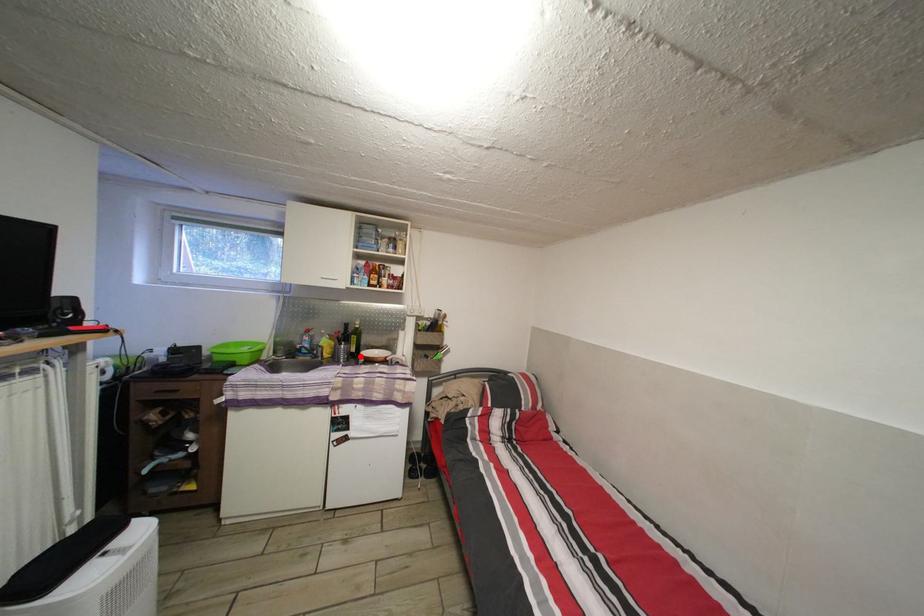
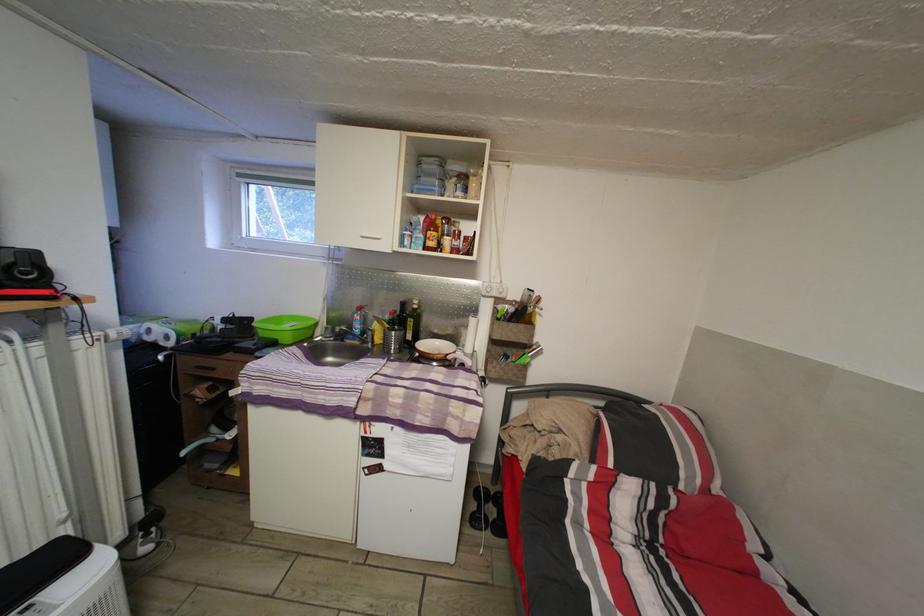
In the second image, find the point that corresponds to the highlighted location in the first image.

(417, 344)